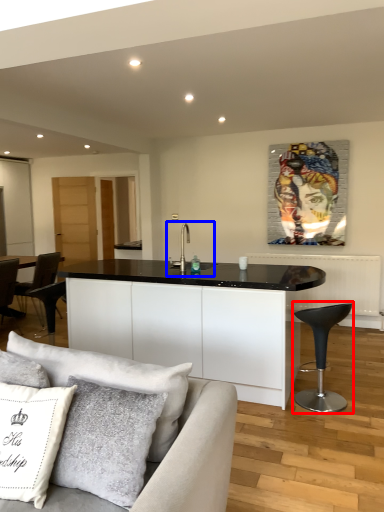
Question: Which point is closer to the camera, bar stool (highlighted by a red box) or sink (highlighted by a blue box)?

Choices:
 (A) bar stool
 (B) sink

Answer: (A)